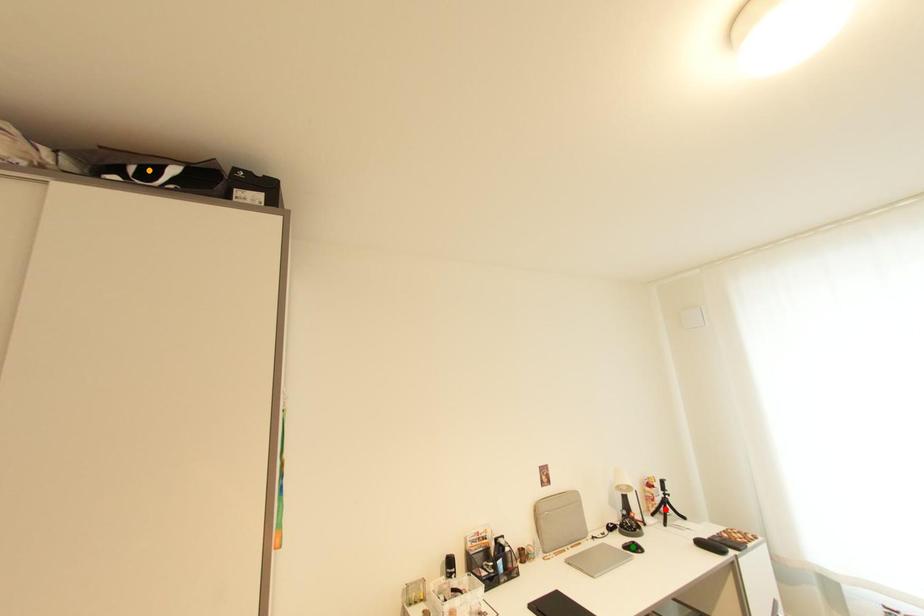
Order these from nearest to farthest:
red point, orange point, green point

1. red point
2. green point
3. orange point